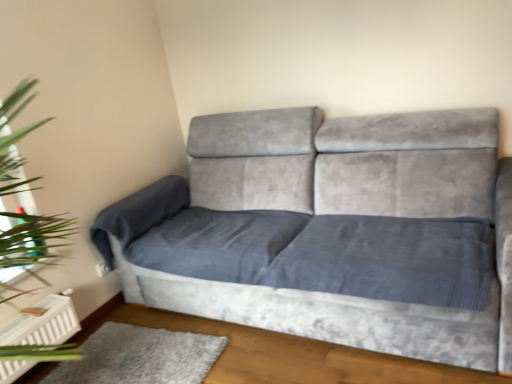
Measure the distance between green leafy plant at left and camera.

green leafy plant at left is 4.22 feet from camera.

This screenshot has width=512, height=384. In order to click on gray plush rug at lower left in this screenshot , I will do `click(140, 357)`.

Describe the element at coordinates (140, 357) in the screenshot. I see `gray plush rug at lower left` at that location.

Find the location of a particular element. green leafy plant at left is located at coordinates (33, 240).

Is teal glass at left positioned far away from green leafy plant at left?

No, teal glass at left is in close proximity to green leafy plant at left.

Can you tell me how much teal glass at left and green leafy plant at left differ in facing direction?

There is a 1.95-degree angle between the facing directions of teal glass at left and green leafy plant at left.

Between teal glass at left and green leafy plant at left, which one has smaller width?

With smaller width is teal glass at left.

Can you confirm if teal glass at left is bigger than green leafy plant at left?

Actually, teal glass at left might be smaller than green leafy plant at left.

Considering the positions of objects teal glass at left and gray plush rug at lower left in the image provided, who is behind, teal glass at left or gray plush rug at lower left?

teal glass at left.

What are the coordinates of `mat below the teal glass at left (from a real-world perspective)` in the screenshot? It's located at (140, 357).

Is point (33, 236) less distant than point (185, 350)?

Yes, point (33, 236) is in front of point (185, 350).

From the image's perspective, is teal glass at left above or below gray plush rug at lower left?

teal glass at left is situated higher than gray plush rug at lower left in the image.

From a real-world perspective, between gray plush rug at lower left and velvet grey couch at center, who is vertically lower?

From a 3D spatial view, gray plush rug at lower left is below.

How different are the orientations of gray plush rug at lower left and velvet grey couch at center in degrees?

3.99 degrees.

Is gray plush rug at lower left located outside velvet grey couch at center?

Yes, gray plush rug at lower left is located beyond the bounds of velvet grey couch at center.

You are a GUI agent. You are given a task and a screenshot of the screen. Output one action in this format:
    pyautogui.click(x=<x>, y=<y>)
    Task: Click on the mat located behind the velvet grey couch at center
    The width and height of the screenshot is (512, 384).
    Given the screenshot: What is the action you would take?
    pyautogui.click(x=140, y=357)

From the image's perspective, is green leafy plant at left on top of velvet grey couch at center?

Indeed, from the image's perspective, green leafy plant at left is shown above velvet grey couch at center.

The image size is (512, 384). In order to click on plant on the left of velvet grey couch at center in this screenshot , I will do `click(33, 240)`.

Is green leafy plant at left oriented towards velvet grey couch at center?

No, green leafy plant at left is not turned towards velvet grey couch at center.

Which object is further away from the camera, green leafy plant at left or velvet grey couch at center?

green leafy plant at left is further away from the camera.

Is green leafy plant at left completely or partially outside of gray plush rug at lower left?

Yes.

What's the angular difference between green leafy plant at left and gray plush rug at lower left's facing directions?

87.9 degrees.

Does green leafy plant at left lie in front of gray plush rug at lower left?

Yes, green leafy plant at left is closer to the camera.

From the picture: Between green leafy plant at left and gray plush rug at lower left, which one has smaller size?

With smaller size is gray plush rug at lower left.

Does green leafy plant at left have a greater height compared to teal glass at left?

Yes, green leafy plant at left is taller than teal glass at left.

From a real-world perspective, is green leafy plant at left positioned over teal glass at left based on gravity?

Correct, in the physical world, green leafy plant at left is higher than teal glass at left.

Considering the points (71, 227) and (21, 212), which point is in front, point (71, 227) or point (21, 212)?

Positioned in front is point (21, 212).

Would you say green leafy plant at left is a long distance from teal glass at left?

No, green leafy plant at left is not far from teal glass at left.

Are velvet grey couch at center and gray plush rug at lower left far apart?

No, velvet grey couch at center is not far from gray plush rug at lower left.

Considering the relative sizes of velvet grey couch at center and gray plush rug at lower left in the image provided, is velvet grey couch at center thinner than gray plush rug at lower left?

No, velvet grey couch at center is not thinner than gray plush rug at lower left.

Is velvet grey couch at center situated inside gray plush rug at lower left or outside?

velvet grey couch at center cannot be found inside gray plush rug at lower left.

In the image, there is a teal glass at left. What are the coordinates of `plant above it (from the image's perspective)` in the screenshot? It's located at (33, 240).

Locate an element on the screen. The height and width of the screenshot is (384, 512). mat on the right of teal glass at left is located at coordinates [x=140, y=357].

Looking at this image, based on their spatial positions, is green leafy plant at left or gray plush rug at lower left closer to teal glass at left?

Based on the image, green leafy plant at left appears to be nearer to teal glass at left.

Estimate the real-world distances between objects in this image. Which object is further from velvet grey couch at center, teal glass at left or green leafy plant at left?

teal glass at left lies further to velvet grey couch at center than the other object.

Which object lies further to the anchor point green leafy plant at left, gray plush rug at lower left or velvet grey couch at center?

Among the two, velvet grey couch at center is located further to green leafy plant at left.

Looking at the image, which one is located further to green leafy plant at left, velvet grey couch at center or teal glass at left?

velvet grey couch at center.

Estimate the real-world distances between objects in this image. Which object is closer to gray plush rug at lower left, velvet grey couch at center or teal glass at left?

Among the two, velvet grey couch at center is located nearer to gray plush rug at lower left.

Which object lies nearer to the anchor point velvet grey couch at center, gray plush rug at lower left or green leafy plant at left?

gray plush rug at lower left is closer to velvet grey couch at center.

In the scene shown: Estimate the real-world distances between objects in this image. Which object is closer to green leafy plant at left, teal glass at left or velvet grey couch at center?

The object closer to green leafy plant at left is teal glass at left.

Based on their spatial positions, is green leafy plant at left or velvet grey couch at center closer to teal glass at left?

green leafy plant at left.

Find the location of a particular element. teal between green leafy plant at left and gray plush rug at lower left in the up-down direction is located at coordinates (37, 241).

Where is `mat between green leafy plant at left and velvet grey couch at center in the horizontal direction`? This screenshot has width=512, height=384. mat between green leafy plant at left and velvet grey couch at center in the horizontal direction is located at coordinates (140, 357).

Where is `teal located between green leafy plant at left and velvet grey couch at center in the left-right direction`? This screenshot has width=512, height=384. teal located between green leafy plant at left and velvet grey couch at center in the left-right direction is located at coordinates (37, 241).

Find the location of a particular element. The image size is (512, 384). mat situated between teal glass at left and velvet grey couch at center from left to right is located at coordinates (140, 357).